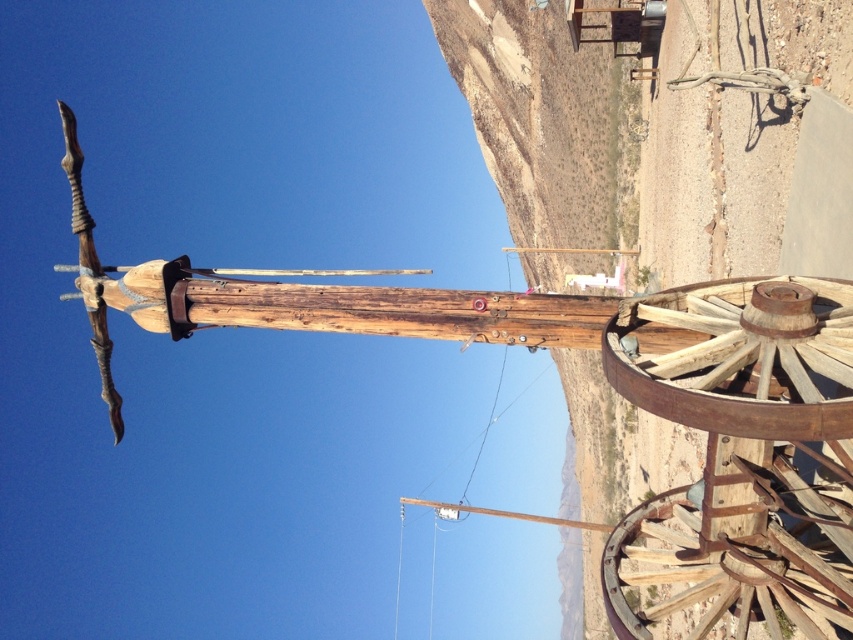
Who is positioned more to the right, rusty wood wagon wheel at lower right or rusty wood wagon wheel at right?

From the viewer's perspective, rusty wood wagon wheel at lower right appears more on the right side.

Is point (824, 484) more distant than point (666, 412)?

Yes, it is behind point (666, 412).

Where is `rusty wood wagon wheel at lower right`? rusty wood wagon wheel at lower right is located at coordinates (735, 556).